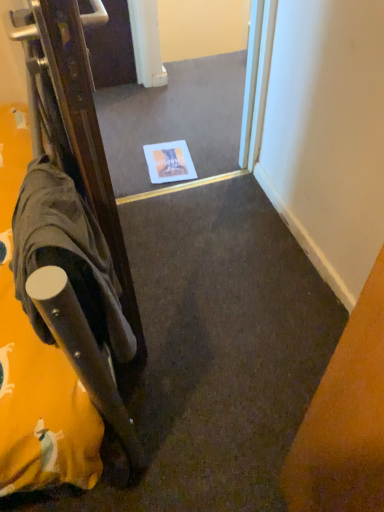
The image size is (384, 512). What are the coordinates of `free point above white glossy mirror at center (from a real-world perspective)` in the screenshot? It's located at (178, 119).